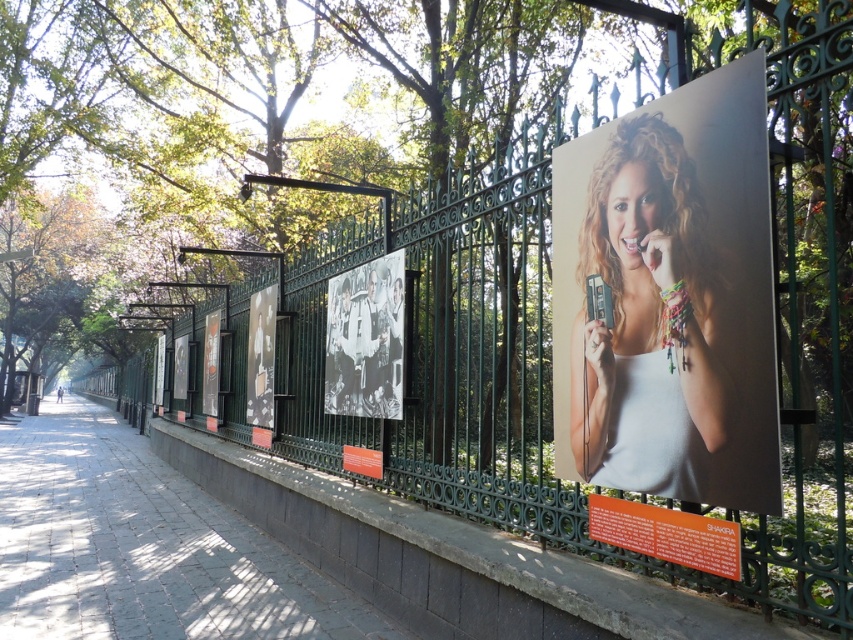
Who is positioned more to the left, paved stone sidewalk at center or black glossy photo frame at center?

paved stone sidewalk at center is more to the left.

This screenshot has height=640, width=853. What do you see at coordinates (142, 547) in the screenshot? I see `paved stone sidewalk at center` at bounding box center [142, 547].

Image resolution: width=853 pixels, height=640 pixels. Find the location of `paved stone sidewalk at center`. paved stone sidewalk at center is located at coordinates (142, 547).

Who is more distant from viewer, (628, 216) or (265, 330)?

Point (265, 330)

Which is below, matte white tank top at center or black glossy photo frame at center?

Positioned lower is black glossy photo frame at center.

Does point (728, 221) lie behind point (248, 420)?

No.

What are the coordinates of `matte white tank top at center` in the screenshot? It's located at (666, 312).

Can you confirm if matte white tank top at center is bigger than paved stone sidewalk at center?

Actually, matte white tank top at center might be smaller than paved stone sidewalk at center.

The height and width of the screenshot is (640, 853). In order to click on matte white tank top at center in this screenshot , I will do `click(666, 312)`.

The height and width of the screenshot is (640, 853). In order to click on matte white tank top at center in this screenshot , I will do (x=666, y=312).